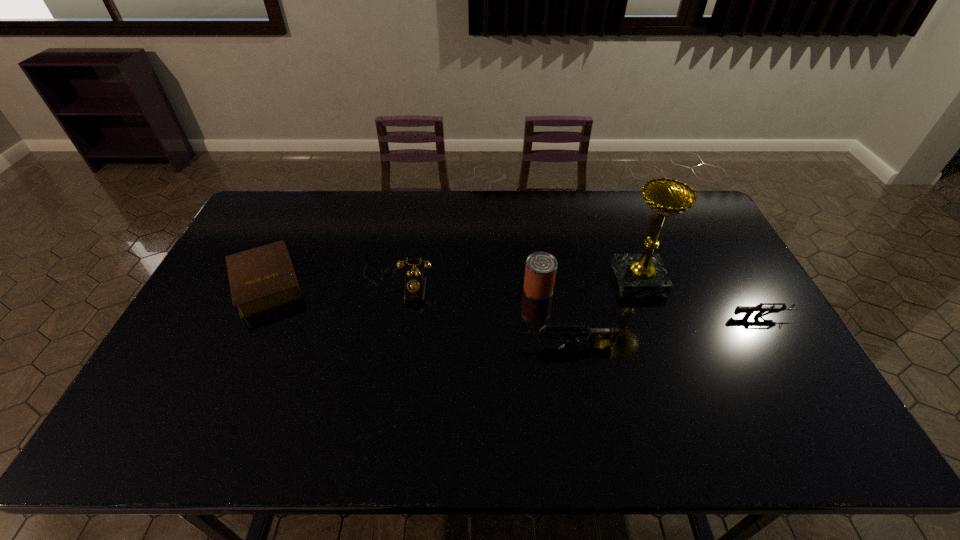
This screenshot has width=960, height=540. What are the coordinates of `vacant point at the far edge` in the screenshot? It's located at (624, 208).

In the image, there is a desktop. Identify the location of vacant space at the near edge. pyautogui.click(x=706, y=381).

I want to click on vacant space at the right edge of the desktop, so click(x=753, y=290).

In order to click on free space that is in between the farther gun and the second object from left to right in this screenshot , I will do `click(580, 299)`.

The width and height of the screenshot is (960, 540). Identify the location of vacant space in between the second object from right to left and the nearer gun. (602, 312).

In order to click on free space that is in between the fifth object from left to right and the can in this screenshot , I will do `click(588, 285)`.

The image size is (960, 540). I want to click on free space between the can and the second object from left to right, so click(x=468, y=285).

Find the location of `empty location between the can and the leftmost object`. empty location between the can and the leftmost object is located at coordinates (402, 286).

Where is `free spot between the fifth object from left to right and the can`? The image size is (960, 540). free spot between the fifth object from left to right and the can is located at coordinates (588, 285).

The height and width of the screenshot is (540, 960). I want to click on free space between the Bible and the can, so click(x=402, y=286).